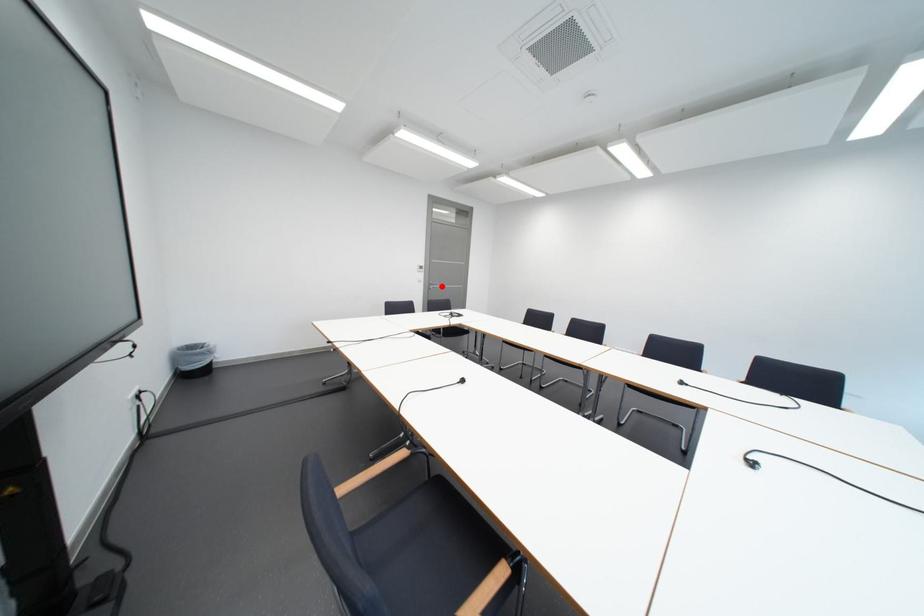
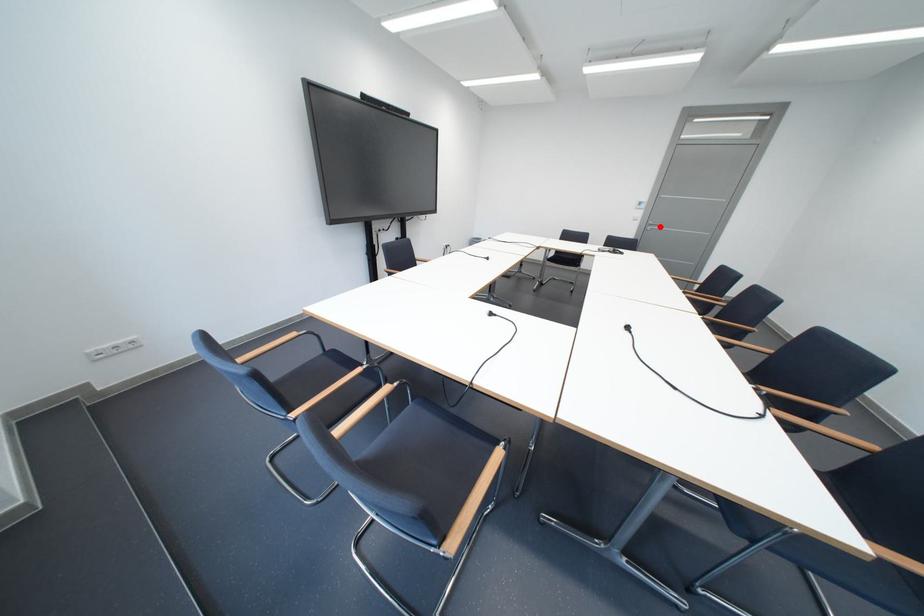
I am providing you with two images of the same scene from different viewpoints. A red point is marked on the first image and another point is marked on the second image. Is the red point in image1 aligned with the point shown in image2?

Yes